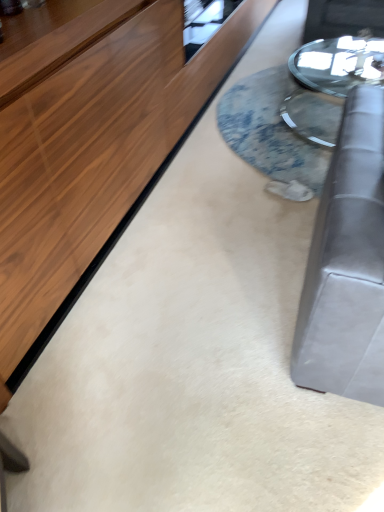
Question: From the image's perspective, is translucent glass table at center, marked as the 1th table in a left-to-right arrangement, located above or below clear glass table at center, which ranks as the second table in left-to-right order?

Choices:
 (A) above
 (B) below

Answer: (B)

Question: Considering the positions of translucent glass table at center, which appears as the second table when viewed from the right, and clear glass table at center, which ranks as the second table in left-to-right order, in the image, is translucent glass table at center, which appears as the second table when viewed from the right, bigger or smaller than clear glass table at center, which ranks as the second table in left-to-right order,?

Choices:
 (A) small
 (B) big

Answer: (A)

Question: Is translucent glass table at center, marked as the 1th table in a left-to-right arrangement, inside or outside of clear glass table at center, which ranks as the second table in left-to-right order?

Choices:
 (A) outside
 (B) inside

Answer: (A)

Question: From their relative heights in the image, would you say clear glass table at center, the first table when ordered from right to left, is taller or shorter than translucent glass table at center, marked as the 1th table in a left-to-right arrangement?

Choices:
 (A) short
 (B) tall

Answer: (B)

Question: From the image's perspective, relative to translucent glass table at center, which appears as the second table when viewed from the right, is clear glass table at center, which ranks as the second table in left-to-right order, above or below?

Choices:
 (A) below
 (B) above

Answer: (B)

Question: Looking at their shapes, would you say clear glass table at center, which ranks as the second table in left-to-right order, is wider or thinner than translucent glass table at center, marked as the 1th table in a left-to-right arrangement?

Choices:
 (A) thin
 (B) wide

Answer: (A)

Question: Is point (302, 92) closer or farther from the camera than point (268, 115)?

Choices:
 (A) closer
 (B) farther

Answer: (B)